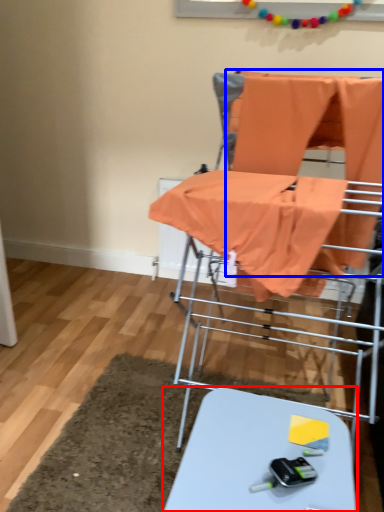
Question: Which object is closer to the camera taking this photo, table (highlighted by a red box) or fabric (highlighted by a blue box)?

Choices:
 (A) table
 (B) fabric

Answer: (A)